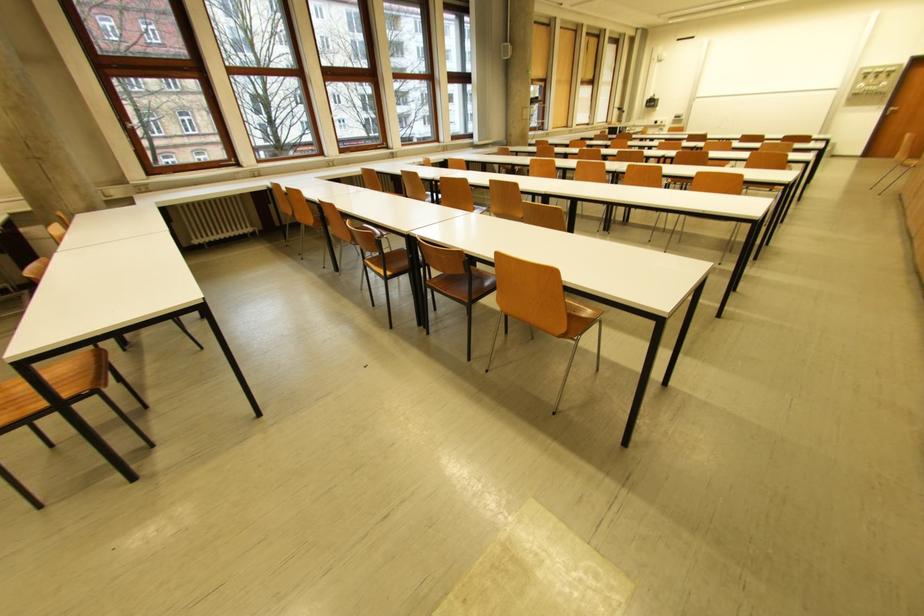
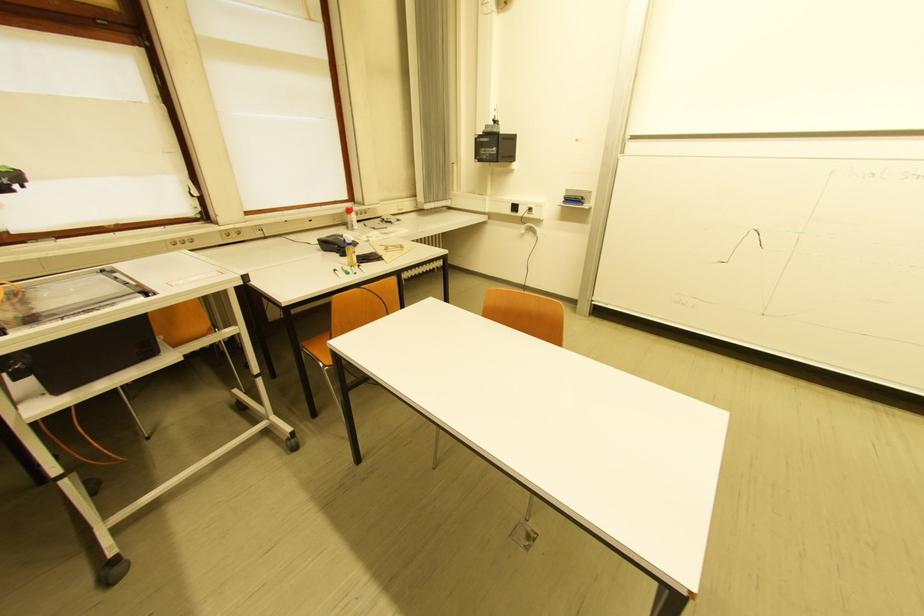
Locate, in the second image, the point that corresponds to (682,119) in the first image.

(575, 201)